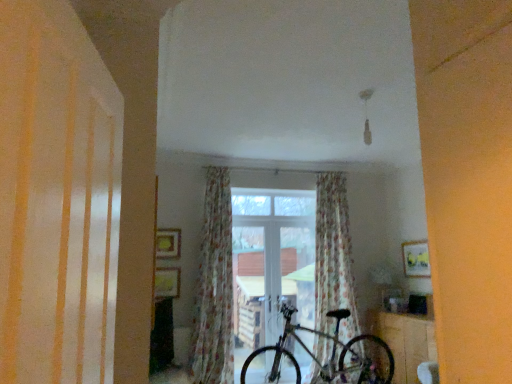
Question: Can you confirm if floral fabric curtain at center, marked as the first curtain in a left-to-right arrangement, is positioned to the left of transparent glass window at center?

Choices:
 (A) no
 (B) yes

Answer: (B)

Question: Does floral fabric curtain at center, marked as the first curtain in a left-to-right arrangement, have a lesser width compared to transparent glass window at center?

Choices:
 (A) no
 (B) yes

Answer: (A)

Question: Is floral fabric curtain at center, marked as the first curtain in a left-to-right arrangement, smaller than transparent glass window at center?

Choices:
 (A) yes
 (B) no

Answer: (B)

Question: Is floral fabric curtain at center, marked as the first curtain in a left-to-right arrangement, bigger than transparent glass window at center?

Choices:
 (A) yes
 (B) no

Answer: (A)

Question: Is floral fabric curtain at center, which is the 2th curtain from right to left, wider than transparent glass window at center?

Choices:
 (A) no
 (B) yes

Answer: (B)

Question: Is floral fabric curtain at center, which is the 2th curtain from right to left, positioned behind transparent glass window at center?

Choices:
 (A) yes
 (B) no

Answer: (B)

Question: From the image's perspective, is floral fabric curtain at center, marked as the first curtain in a left-to-right arrangement, under wooden table at lower right?

Choices:
 (A) no
 (B) yes

Answer: (A)

Question: Considering the relative sizes of floral fabric curtain at center, which is the 2th curtain from right to left, and wooden table at lower right in the image provided, is floral fabric curtain at center, which is the 2th curtain from right to left, taller than wooden table at lower right?

Choices:
 (A) no
 (B) yes

Answer: (B)

Question: From a real-world perspective, is floral fabric curtain at center, marked as the first curtain in a left-to-right arrangement, on top of wooden table at lower right?

Choices:
 (A) no
 (B) yes

Answer: (B)

Question: Is floral fabric curtain at center, which is the 2th curtain from right to left, positioned with its back to wooden table at lower right?

Choices:
 (A) no
 (B) yes

Answer: (A)

Question: Can you confirm if floral fabric curtain at center, which is the 2th curtain from right to left, is smaller than wooden table at lower right?

Choices:
 (A) yes
 (B) no

Answer: (B)

Question: Is wooden table at lower right not within shiny metallic bicycle at center?

Choices:
 (A) yes
 (B) no

Answer: (A)